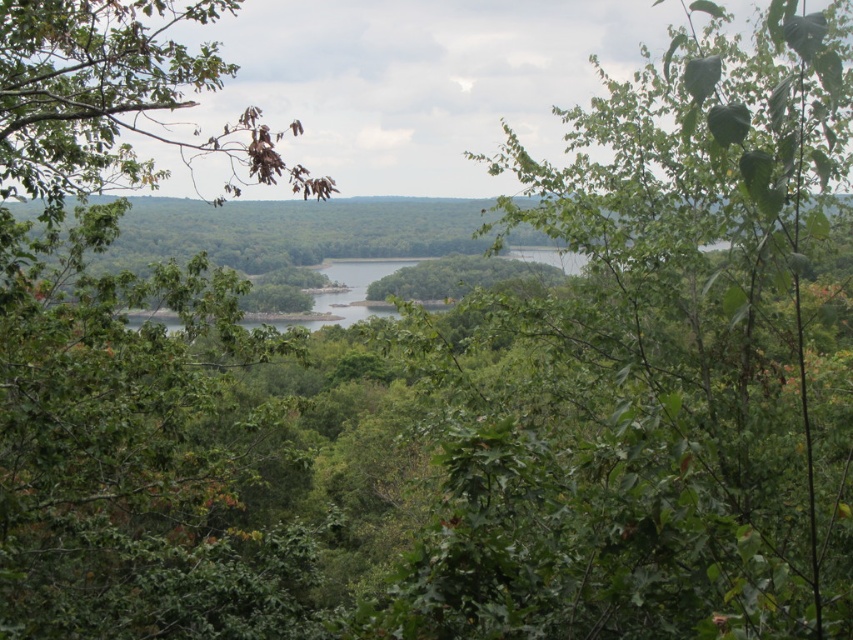
Is green leafy tree at center shorter than green leafy tree at left?

Yes, green leafy tree at center is shorter than green leafy tree at left.

In the scene shown: Is green leafy tree at center taller than green leafy tree at left?

No.

This screenshot has height=640, width=853. What are the coordinates of `green leafy tree at center` in the screenshot? It's located at (660, 369).

I want to click on green leafy tree at center, so click(660, 369).